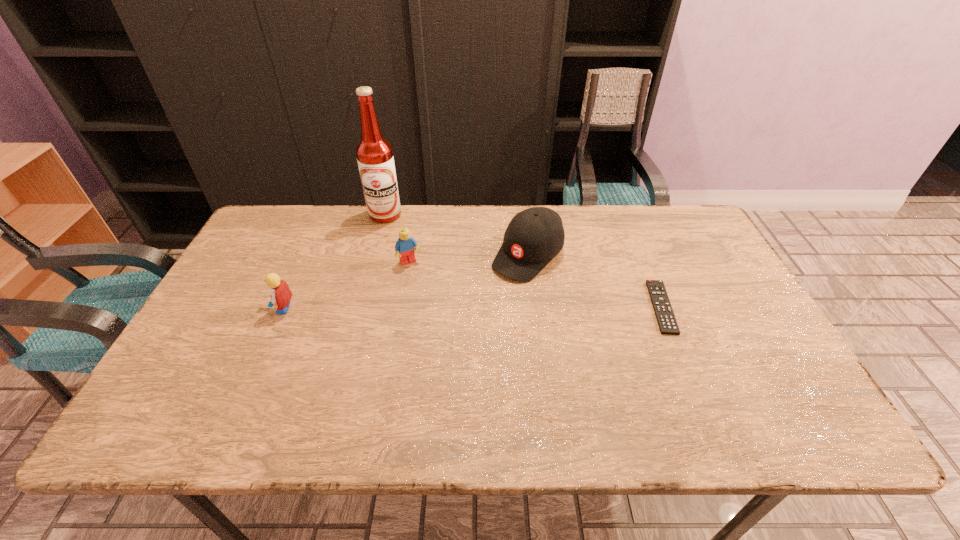
Locate an element on the screen. The width and height of the screenshot is (960, 540). vacant region located on the front-facing side of the leftmost object is located at coordinates (210, 308).

This screenshot has height=540, width=960. In order to click on free space located on the back of the remote control in this screenshot , I will do `click(643, 264)`.

Find the location of a particular element. free spot located with a logo on the front of the baseball cap is located at coordinates (454, 333).

Find the location of `free space located with a logo on the front of the baseball cap`. free space located with a logo on the front of the baseball cap is located at coordinates (484, 302).

Find the location of a particular element. The width and height of the screenshot is (960, 540). vacant area situated with a logo on the front of the baseball cap is located at coordinates click(498, 288).

The width and height of the screenshot is (960, 540). Identify the location of vacant region located on the label side of the alcohol. (416, 294).

Locate an element on the screen. This screenshot has height=540, width=960. free spot located 0.080m on the label side of the alcohol is located at coordinates (395, 238).

In order to click on free spot located 0.230m on the label side of the alcohol in this screenshot , I will do `click(405, 267)`.

I want to click on vacant region located 0.060m on the face of the right Lego, so click(421, 281).

I want to click on blank space located on the face of the right Lego, so click(424, 285).